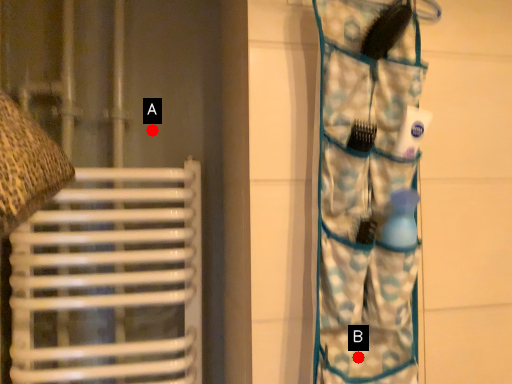
Question: Two points are circled on the image, labeled by A and B beside each circle. Which point appears closest to the camera in this image?

Choices:
 (A) A is closer
 (B) B is closer

Answer: (B)